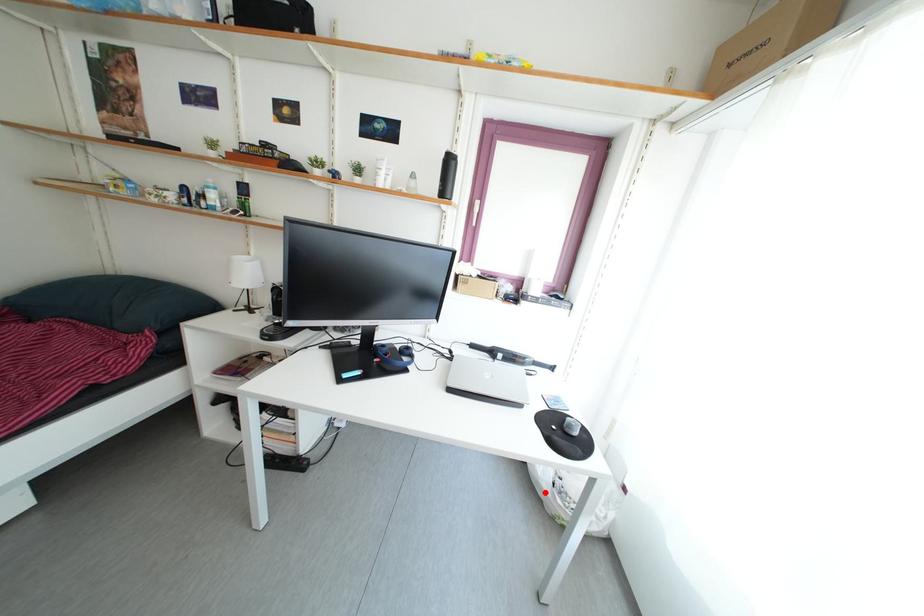
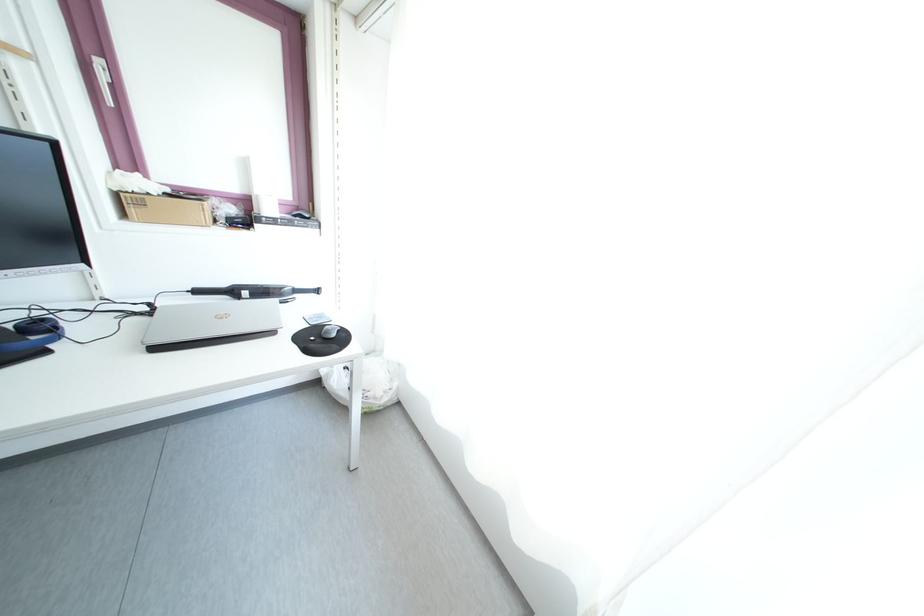
In the second image, find the point that corresponds to the highlighted location in the first image.

(344, 403)